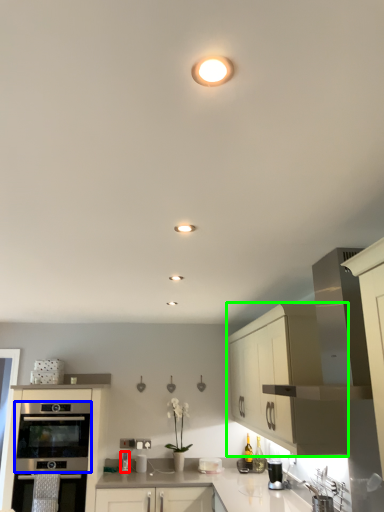
Question: Which is farther away from appliance (highlighted by a red box)? oven (highlighted by a blue box) or cabinetry (highlighted by a green box)?

Choices:
 (A) oven
 (B) cabinetry

Answer: (B)